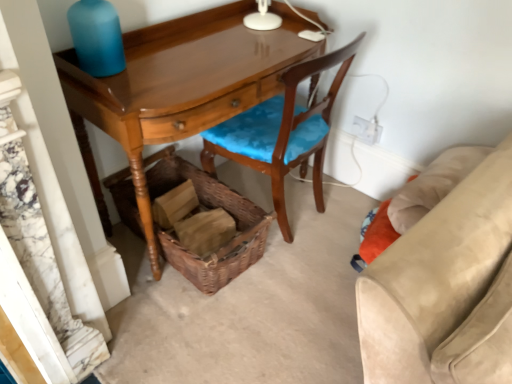
Locate an element on the screen. The width and height of the screenshot is (512, 384). free space in front of blue matte bottle at upper left is located at coordinates (112, 87).